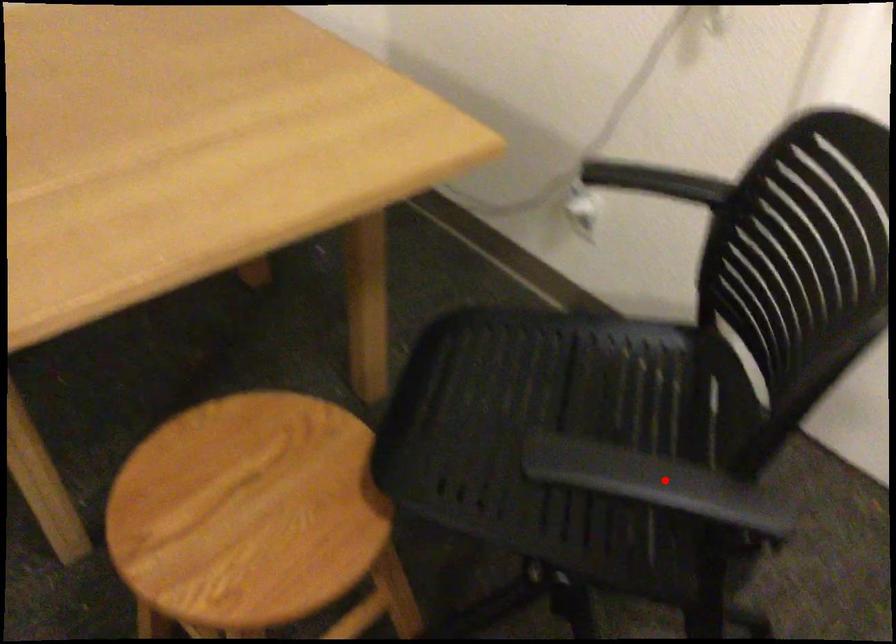
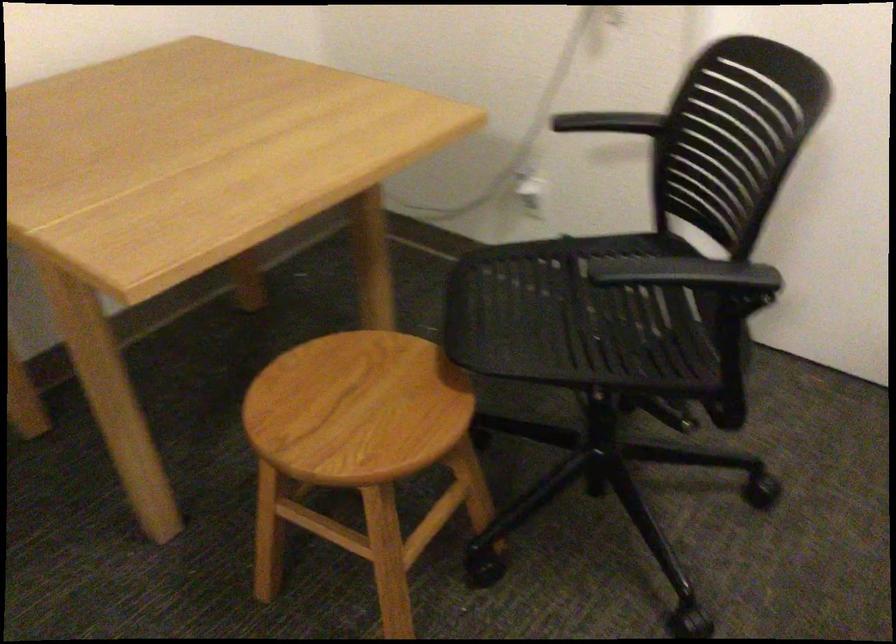
Question: I am providing you with two images of the same scene from different viewpoints. Given a red point in image1, look at the same physical point in image2. Is it:

Choices:
 (A) Closer to the viewpoint
 (B) Farther from the viewpoint

Answer: (B)